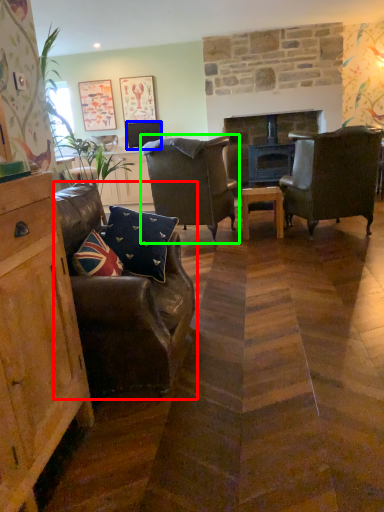
Question: Which object is the farthest from chair (highlighted by a red box)? Choose among these: television (highlighted by a blue box) or chair (highlighted by a green box).

Choices:
 (A) television
 (B) chair

Answer: (A)